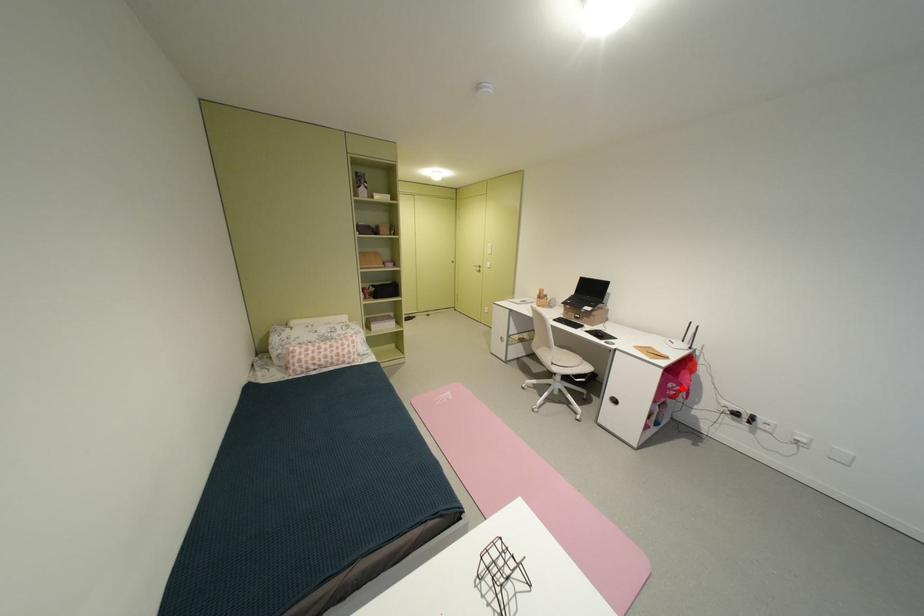
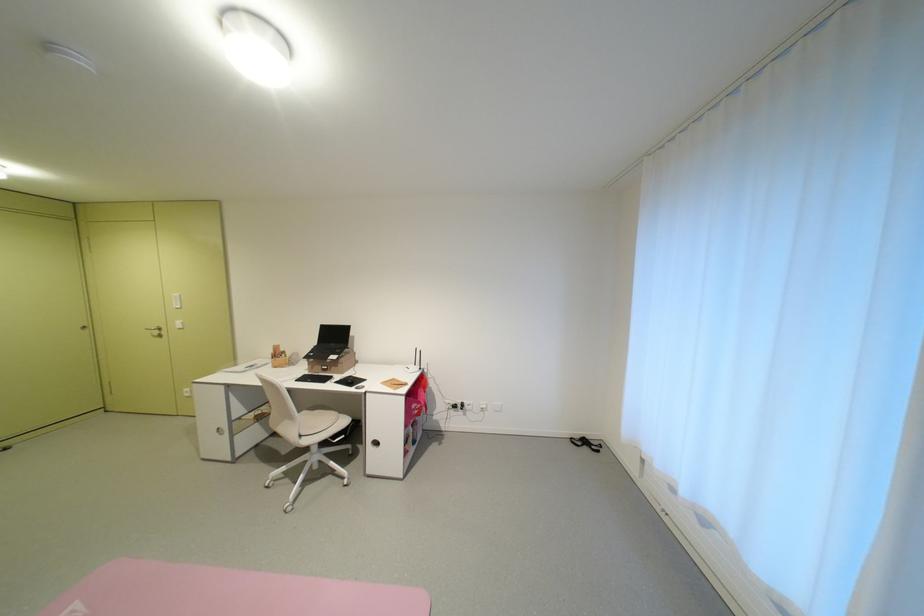
Find the pixel in the second image that matches the highlighted location in the first image.

(424, 408)